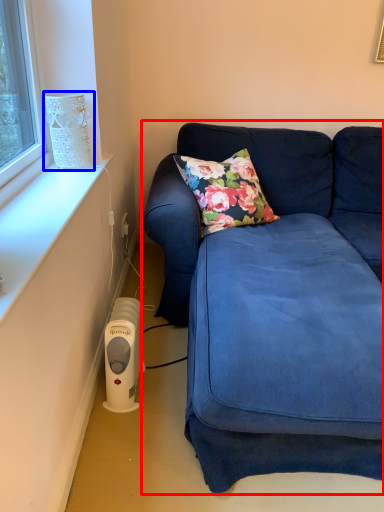
Question: Which of the following is the closest to the observer, studio couch (highlighted by a red box) or lamp (highlighted by a blue box)?

Choices:
 (A) studio couch
 (B) lamp

Answer: (A)